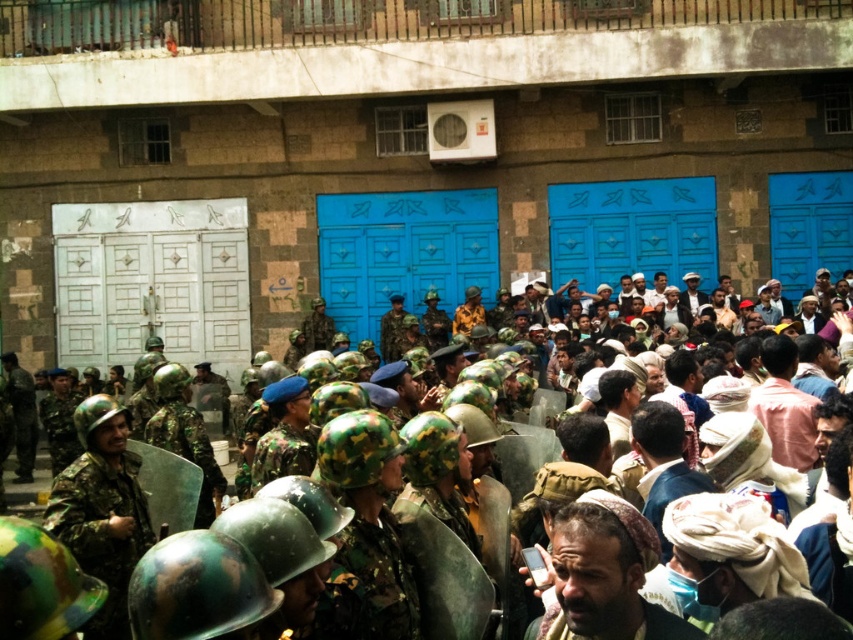
Question: Based on their relative distances, which object is nearer to the camouflage helmeted crowd at center?

Choices:
 (A) brown leather cap at center
 (B) camouflage uniform at center

Answer: (A)

Question: Which of the following is the farthest from the observer?

Choices:
 (A) (401, 314)
 (B) (608, 545)

Answer: (A)

Question: Is brown leather cap at center bigger than camouflage uniform at center?

Choices:
 (A) no
 (B) yes

Answer: (B)

Question: From the image, what is the correct spatial relationship of camouflage helmeted crowd at center in relation to camouflage uniform at center?

Choices:
 (A) right
 (B) left

Answer: (A)

Question: Is brown leather cap at center smaller than camouflage uniform at center?

Choices:
 (A) yes
 (B) no

Answer: (B)

Question: Which of the following is the farthest from the observer?

Choices:
 (A) brown leather cap at center
 (B) camouflage uniform at center

Answer: (B)